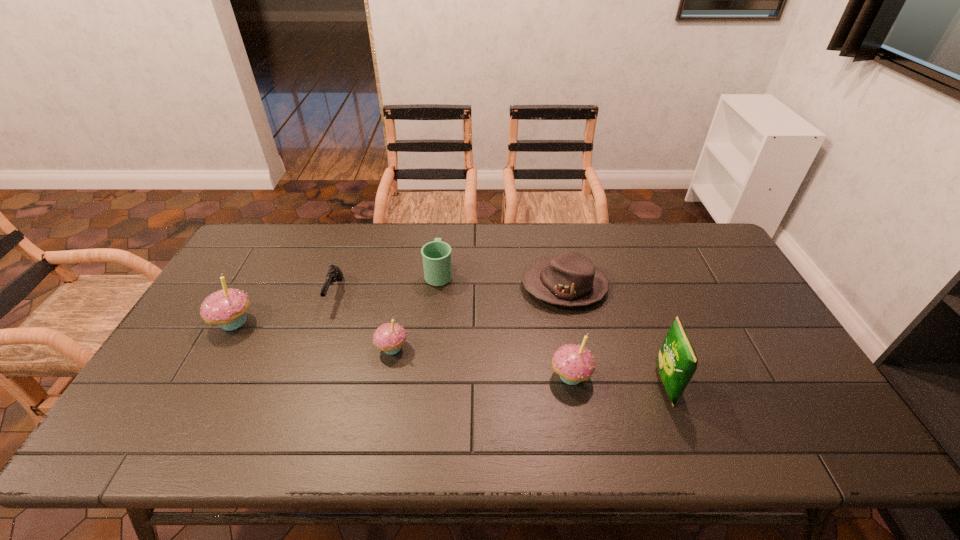
The height and width of the screenshot is (540, 960). Identify the location of vacant space at the left edge of the desktop. (212, 355).

You are a GUI agent. You are given a task and a screenshot of the screen. Output one action in this format:
    pyautogui.click(x=<x>, y=<y>)
    Task: Click on the free region at the right edge of the desktop
    
    Given the screenshot: What is the action you would take?
    pyautogui.click(x=724, y=296)

This screenshot has width=960, height=540. I want to click on vacant space at the near right corner, so click(756, 388).

Find the location of `free area in between the mug and the hat`. free area in between the mug and the hat is located at coordinates (501, 279).

Find the location of `free space between the gun and the hat`. free space between the gun and the hat is located at coordinates (449, 289).

In order to click on free space between the leftmost object and the shortest object in this screenshot , I will do `click(284, 308)`.

I want to click on unoccupied position between the mug and the leftmost cupcake, so click(x=336, y=298).

The image size is (960, 540). I want to click on free space between the leftmost object and the rightmost object, so click(x=449, y=353).

This screenshot has width=960, height=540. In order to click on free area in between the second shortest cupcake and the hat in this screenshot , I will do `click(567, 331)`.

You are a GUI agent. You are given a task and a screenshot of the screen. Output one action in this format:
    pyautogui.click(x=<x>, y=<y>)
    Task: Click on the vacant area that lies between the third tallest object and the rightmost object
    
    Given the screenshot: What is the action you would take?
    pyautogui.click(x=618, y=380)